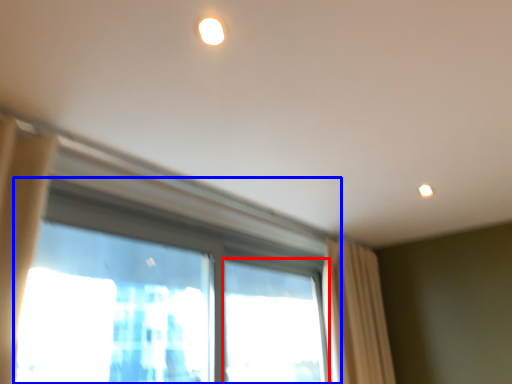
Question: Which object appears farthest to the camera in this image, window (highlighted by a red box) or window (highlighted by a blue box)?

Choices:
 (A) window
 (B) window

Answer: (A)